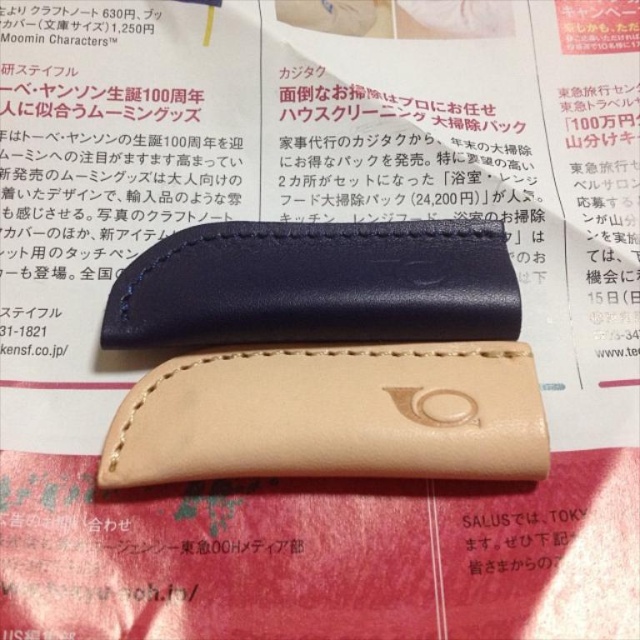
Image resolution: width=640 pixels, height=640 pixels. What do you see at coordinates (332, 416) in the screenshot?
I see `tan leather case at center` at bounding box center [332, 416].

Is tan leather case at center further to the viewer compared to matte black leather case at upper center?

No, it is in front of matte black leather case at upper center.

This screenshot has height=640, width=640. Describe the element at coordinates (332, 416) in the screenshot. I see `tan leather case at center` at that location.

Find the location of a particular element. Image resolution: width=640 pixels, height=640 pixels. tan leather case at center is located at coordinates (332, 416).